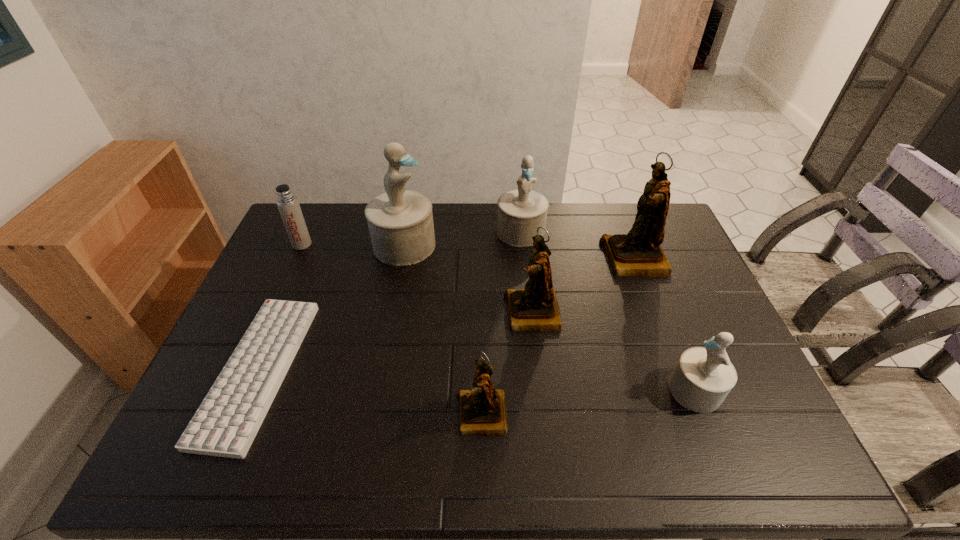
Find the location of a particular element. the biggest white figurine is located at coordinates click(x=400, y=222).

The width and height of the screenshot is (960, 540). In order to click on the leftmost white figurine in this screenshot , I will do `click(400, 222)`.

Where is `the rightmost gold figurine`? the rightmost gold figurine is located at coordinates (638, 253).

You are a GUI agent. You are given a task and a screenshot of the screen. Output one action in this format:
    pyautogui.click(x=<x>, y=<y>)
    Task: Click on the farthest gold figurine
    This screenshot has height=540, width=960.
    Given the screenshot: What is the action you would take?
    pyautogui.click(x=638, y=253)

At what (x,y) coordinates should I click in order to perform the action: click on the second white figurine from left to right. Please return your answer as a coordinate pair (x, y). This screenshot has width=960, height=540. Looking at the image, I should click on (521, 211).

Find the location of a particular element. The width and height of the screenshot is (960, 540). the second biggest gold figurine is located at coordinates (535, 308).

In order to click on the fourth farthest figurine in this screenshot , I will do `click(535, 308)`.

What are the coordinates of `thermos bottle` in the screenshot? It's located at (287, 203).

Find the location of a particular element. Image resolution: width=960 pixels, height=540 pixels. the nearest white figurine is located at coordinates (703, 377).

The width and height of the screenshot is (960, 540). I want to click on the smallest white figurine, so click(x=703, y=377).